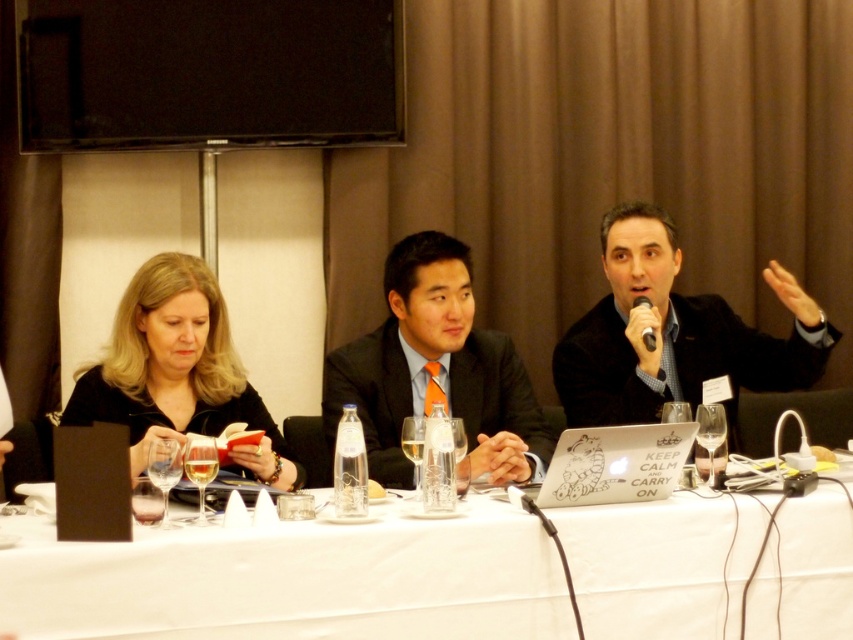
Question: Is white glossy table at center positioned before black wool suit at right?

Choices:
 (A) no
 (B) yes

Answer: (B)

Question: Estimate the real-world distances between objects in this image. Which object is closer to the black matte jacket at left?

Choices:
 (A) black wool suit at right
 (B) black plastic microphone at upper center

Answer: (A)

Question: Estimate the real-world distances between objects in this image. Which object is closer to the black matte jacket at left?

Choices:
 (A) white glossy table at center
 (B) black wool suit at right

Answer: (A)

Question: Is matte black suit at center below black plastic microphone at upper center?

Choices:
 (A) yes
 (B) no

Answer: (A)

Question: Does black matte jacket at left have a larger size compared to matte black suit at center?

Choices:
 (A) yes
 (B) no

Answer: (A)

Question: Among these objects, which one is farthest from the camera?

Choices:
 (A) black wool suit at right
 (B) matte black suit at center

Answer: (A)